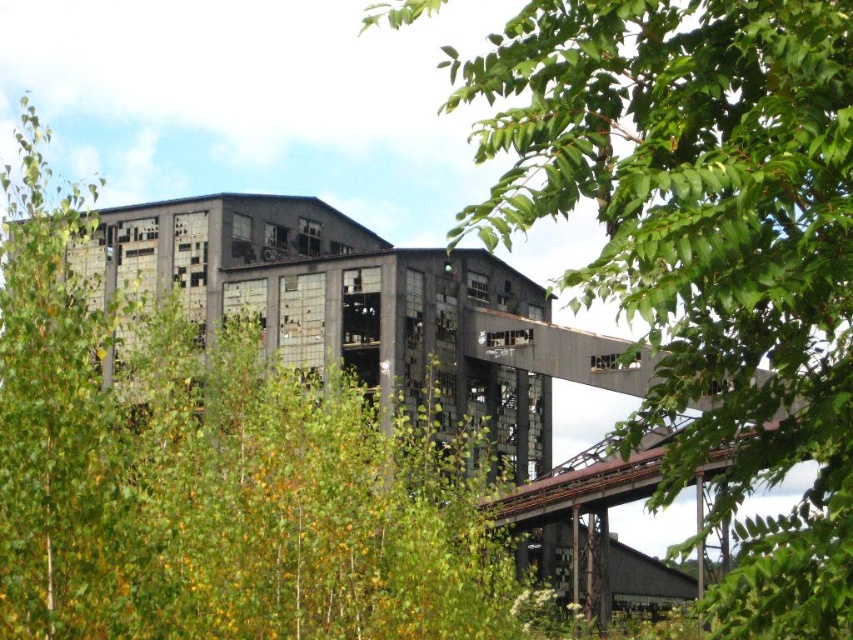
Does green leafy tree at upper right appear on the left side of green leafy tree at center?

Incorrect, green leafy tree at upper right is not on the left side of green leafy tree at center.

Can you confirm if green leafy tree at upper right is bigger than green leafy tree at center?

Incorrect, green leafy tree at upper right is not larger than green leafy tree at center.

Who is more distant from viewer, (848, 196) or (50, 556)?

The point (50, 556) is more distant.

You are a GUI agent. You are given a task and a screenshot of the screen. Output one action in this format:
    pyautogui.click(x=<x>, y=<y>)
    Task: Click on the green leafy tree at upper right
    
    Given the screenshot: What is the action you would take?
    pyautogui.click(x=704, y=244)